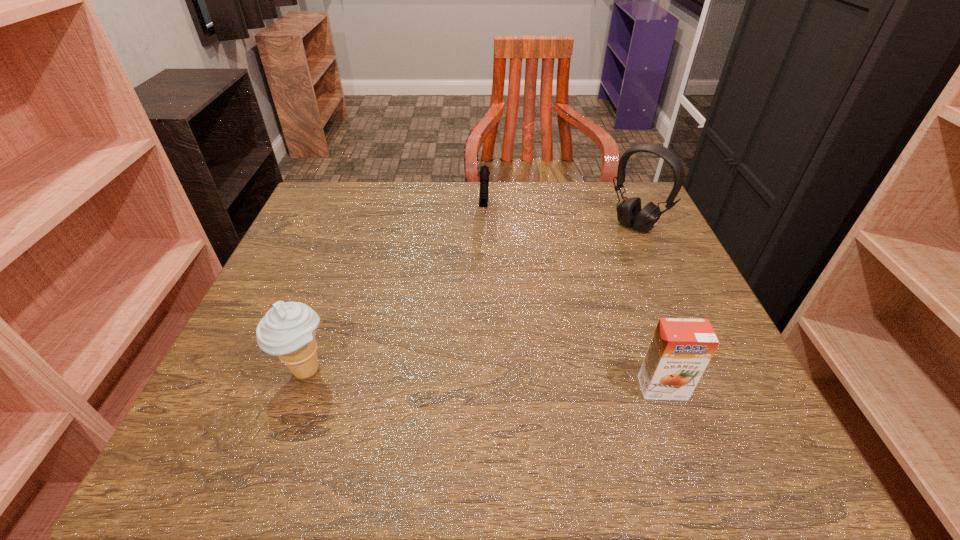
Locate an element on the screen. icecream is located at coordinates (287, 330).

Where is `the second shortest object`? the second shortest object is located at coordinates (681, 348).

In order to click on the shortest object in this screenshot , I will do `click(484, 172)`.

This screenshot has height=540, width=960. What are the coordinates of `the second object from left to right` in the screenshot? It's located at (484, 172).

At what (x,y) coordinates should I click in order to perform the action: click on the tallest object. Please return your answer as a coordinate pair (x, y). Image resolution: width=960 pixels, height=540 pixels. Looking at the image, I should click on (629, 213).

This screenshot has height=540, width=960. I want to click on free region located 0.110m on the right of the icecream, so click(x=396, y=371).

Image resolution: width=960 pixels, height=540 pixels. In order to click on free space located 0.190m on the back of the second shortest object in this screenshot , I will do `click(631, 300)`.

Find the location of `free space located 0.190m on the front-facing side of the second object from left to right`. free space located 0.190m on the front-facing side of the second object from left to right is located at coordinates (483, 286).

At what (x,y) coordinates should I click in order to perform the action: click on free space located 0.240m on the front-facing side of the second object from left to right. Please return your answer as a coordinate pair (x, y). This screenshot has height=540, width=960. Looking at the image, I should click on (482, 302).

Where is `free space located on the front-facing side of the second object from left to right`? The width and height of the screenshot is (960, 540). free space located on the front-facing side of the second object from left to right is located at coordinates (483, 286).